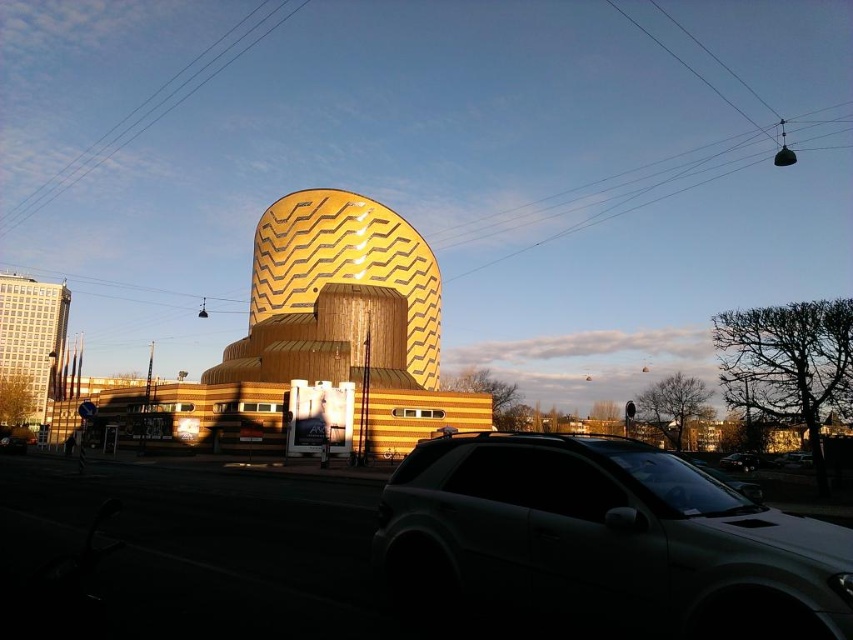
Consider the image. You are a photographer standing in front of the architectural structure. You want to capture a photo where both the gold textured dome at center and the satin silver suv at center are visible. Which object should you focus on first to ensure both are in frame?

The gold textured dome at center is taller than the satin silver suv at center, so you should focus on the gold textured dome at center first to ensure both are in frame.

You are standing at the entrance of the building and want to park your matte black suv at lower right. Based on the coordinates provided, where should you position yourself to ensure the suv is correctly placed?

The matte black suv at lower right should be positioned at coordinates point (602, 541) to ensure correct placement.

You are standing in front of the building and want to take a photo of the gold textured dome at center without the matte black suv at lower right blocking it. Which direction should you move to ensure the suv is out of the frame?

Move away from the matte black suv at lower right and towards the building. Since the matte black suv at lower right is closer to the viewer than the gold textured dome at center, moving closer to the building would reduce the suv appearing in the foreground, potentially allowing the dome to be centered without obstruction.